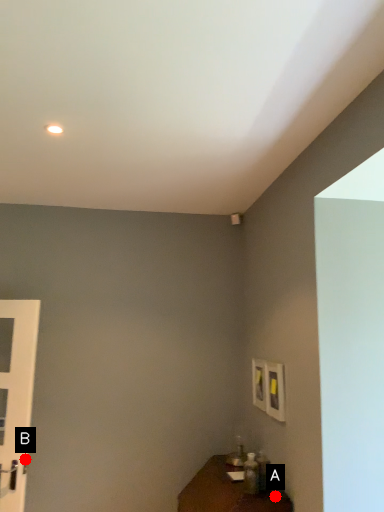
Question: Two points are circled on the image, labeled by A and B beside each circle. Which point is farther from the camera taking this photo?

Choices:
 (A) A is further
 (B) B is further

Answer: (B)